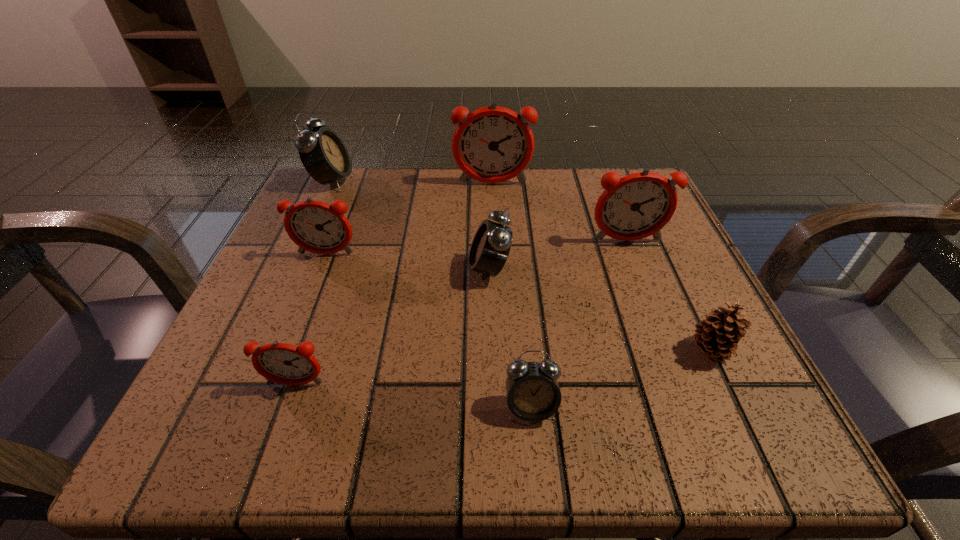
You are a GUI agent. You are given a task and a screenshot of the screen. Output one action in this format:
    pyautogui.click(x=<x>, y=<y>)
    Task: Click on the alarm clock situated at the right edge
    The image size is (960, 540).
    Given the screenshot: What is the action you would take?
    pyautogui.click(x=639, y=205)

Find the location of `pinecone at the right edge`. pinecone at the right edge is located at coordinates 717,336.

Find the location of a particular element. The image size is (960, 540). object present at the far left corner is located at coordinates (323, 154).

Locate an element on the screen. object that is at the near left corner is located at coordinates (286, 364).

This screenshot has height=540, width=960. I want to click on vacant space at the far edge of the desktop, so click(459, 185).

In the image, there is a desktop. Where is `free space at the right edge`? free space at the right edge is located at coordinates (617, 254).

The image size is (960, 540). Identify the location of free spot at the far left corner of the desktop. coord(284,231).

What are the coordinates of `vacant space at the far right corner` in the screenshot? It's located at (636, 171).

At what (x,y) coordinates should I click in order to perform the action: click on vacant area at the near right corner. Please return your answer as a coordinate pair (x, y). Looking at the image, I should click on (730, 395).

This screenshot has width=960, height=540. What are the coordinates of `unoccupied area between the second smallest white alarm clock and the nearest white alarm clock` in the screenshot? It's located at (x=510, y=339).